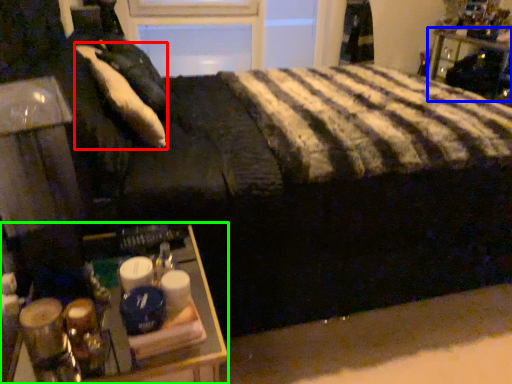
Question: Based on their relative distances, which object is farther from pillow (highlighted by a red box)? Choose from furniture (highlighted by a blue box) and table (highlighted by a green box).

Choices:
 (A) furniture
 (B) table

Answer: (A)